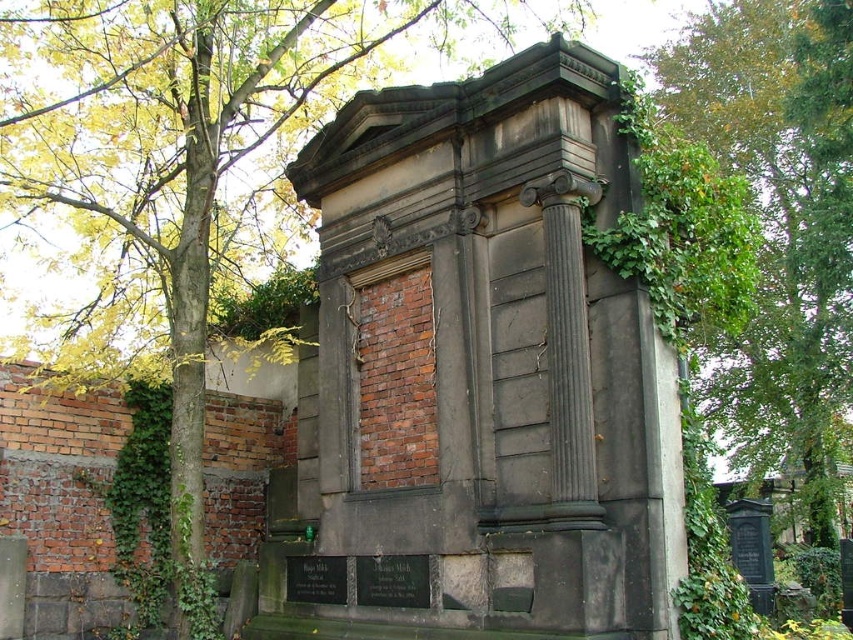
You are a gardener who needs to water both the dark gray stone monument at center and the green leafy tree at upper center. Your watering can holds enough water for 10 meters of travel. If you start at the monument, can you reach the tree without refilling your can?

The dark gray stone monument at center and green leafy tree at upper center are 9.32 meters apart. Since the watering can can cover 10 meters, you can water both without needing to refill.

You are standing in a cemetery and want to take a photo of the dark gray stone monument at center. However, the green leafy tree at upper center is blocking your view. Can you move closer to the monument to get a clear shot without the tree in the frame?

The dark gray stone monument at center is smaller than the green leafy tree at upper center. Since the tree is larger, moving closer to the monument might still leave the tree visible in the frame. You may need to adjust your angle or position to avoid the tree obstructing the monument.